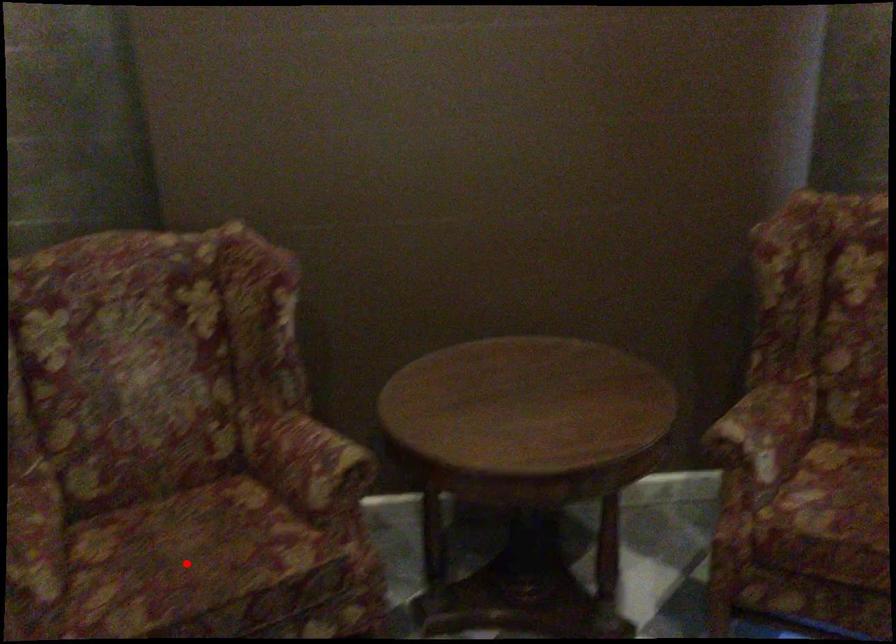
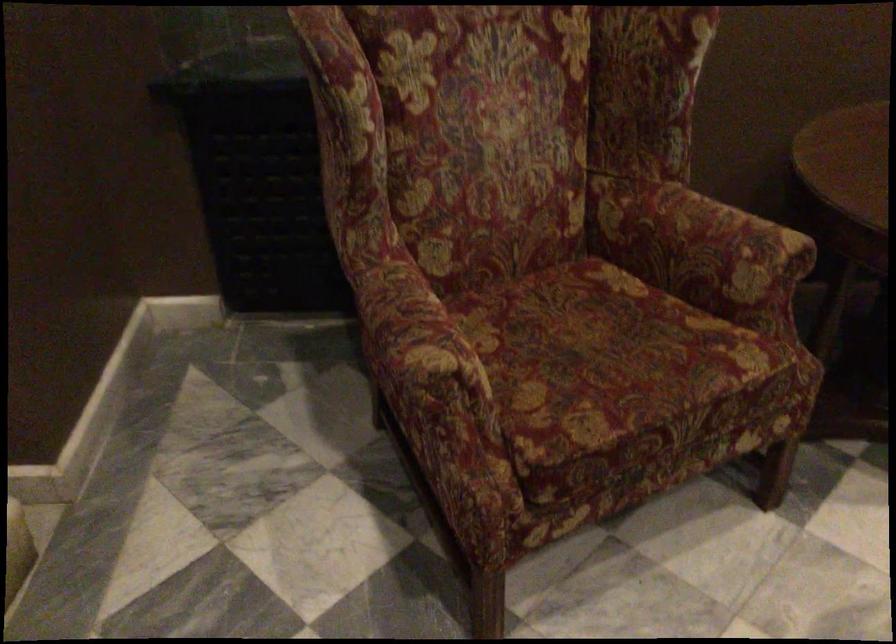
Locate, in the second image, the point that corresponds to the highlighted location in the first image.

(606, 361)